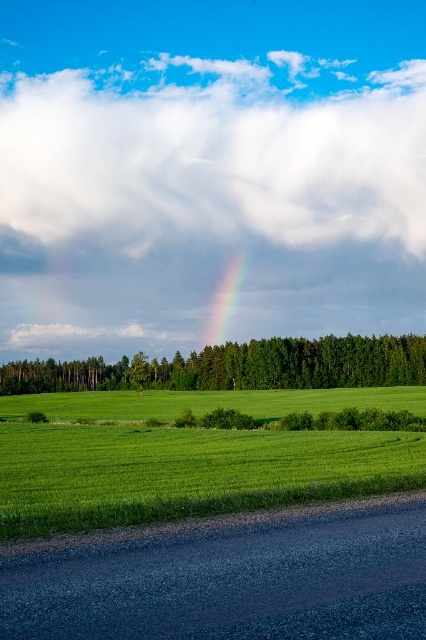
You are a farmer planning to install a solar panel array. You need to choose between placing them on the green grassy field at center or under the green leafy tree at center. Which location would provide more consistent sunlight exposure for the solar panels?

The green grassy field at center is shorter than the green leafy tree at center, so placing the solar panels on the green grassy field at center would provide more consistent sunlight exposure because they won

You are a photographer planning to capture the rainbow at center and the green grassy field at center in a single shot. Based on their positions, which object should you focus on first to ensure both are in frame?

The green grassy field at center is positioned under rainbow at center, so you should focus on the rainbow at center first to ensure both are in frame.

You are a drone operator trying to capture aerial footage of the green grassy field at center and the green leafy tree at center. Which object would require a wider shot to fully capture in the frame?

The green leafy tree at center requires a wider shot because it has a greater width than the green grassy field at center.